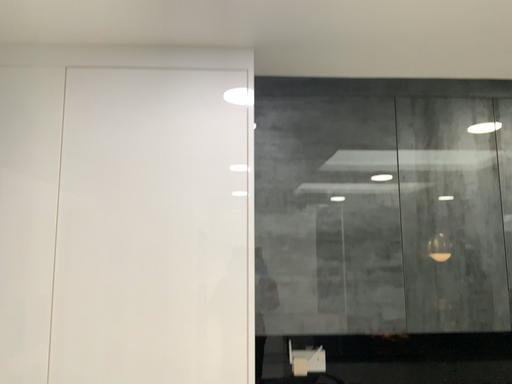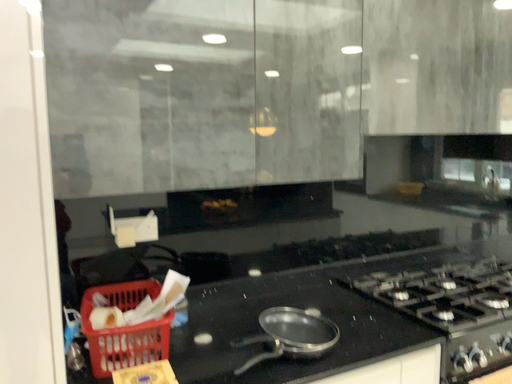
Question: How did the camera likely rotate when shooting the video?

Choices:
 (A) rotated left
 (B) rotated right

Answer: (B)